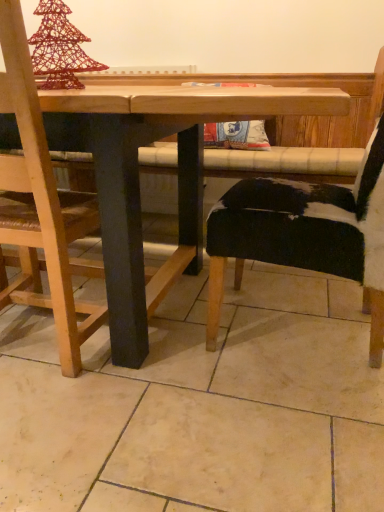
Question: From a real-world perspective, is wooden chair at left, the 2th chair viewed from the right, above or below black cowhide chair at right, which is counted as the first chair, starting from the right?

Choices:
 (A) below
 (B) above

Answer: (B)

Question: From the image's perspective, is wooden chair at left, which is the first chair in left-to-right order, positioned above or below black cowhide chair at right, the second chair in the left-to-right sequence?

Choices:
 (A) above
 (B) below

Answer: (B)

Question: Considering the real-world distances, which object is farthest from the black cowhide chair at right, the second chair in the left-to-right sequence?

Choices:
 (A) wooden chair at left, which is the first chair in left-to-right order
 (B) wooden table at center

Answer: (A)

Question: Which is farther from the wooden chair at left, which is the first chair in left-to-right order?

Choices:
 (A) black cowhide chair at right, which is counted as the first chair, starting from the right
 (B) wooden table at center

Answer: (A)